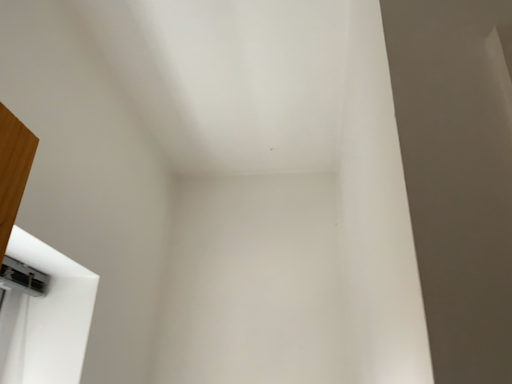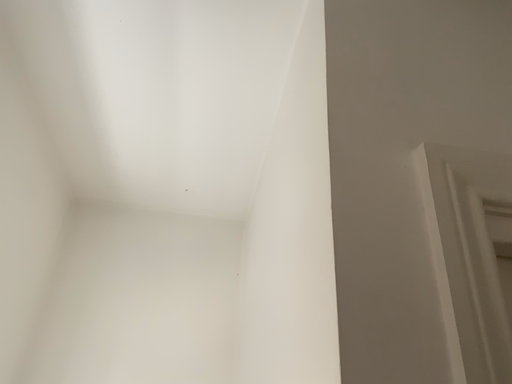
Question: How did the camera likely rotate when shooting the video?

Choices:
 (A) rotated right
 (B) rotated left

Answer: (A)